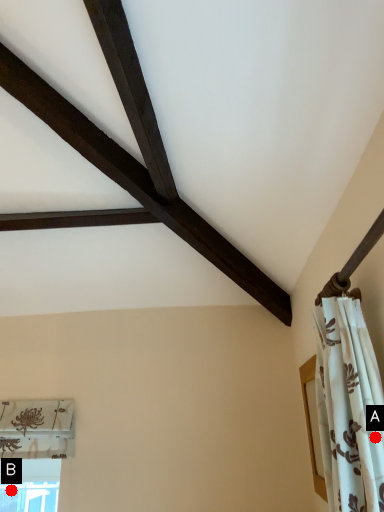
Question: Two points are circled on the image, labeled by A and B beside each circle. Among these points, which one is nearest to the camera?

Choices:
 (A) A is closer
 (B) B is closer

Answer: (A)